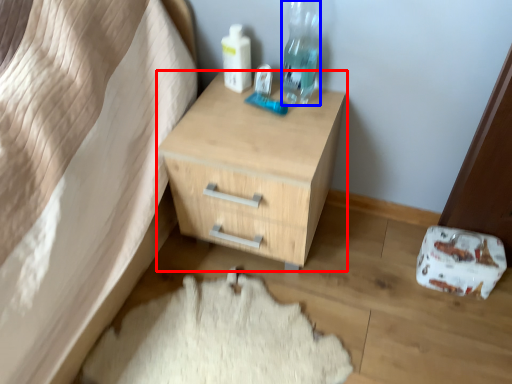
Question: Which object appears closest to the camera in this image, chest of drawers (highlighted by a red box) or bottle (highlighted by a blue box)?

Choices:
 (A) chest of drawers
 (B) bottle

Answer: (A)